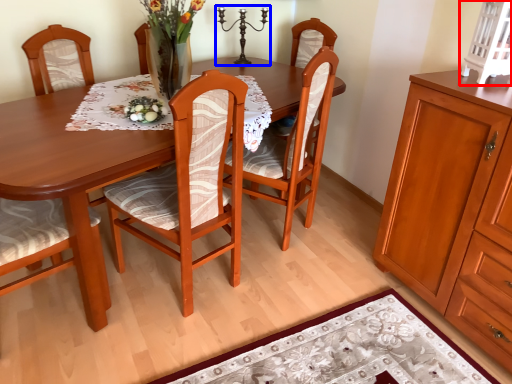
Question: Which of the following is the closest to the observer, cabinetry (highlighted by a red box) or candle holder (highlighted by a blue box)?

Choices:
 (A) cabinetry
 (B) candle holder

Answer: (A)